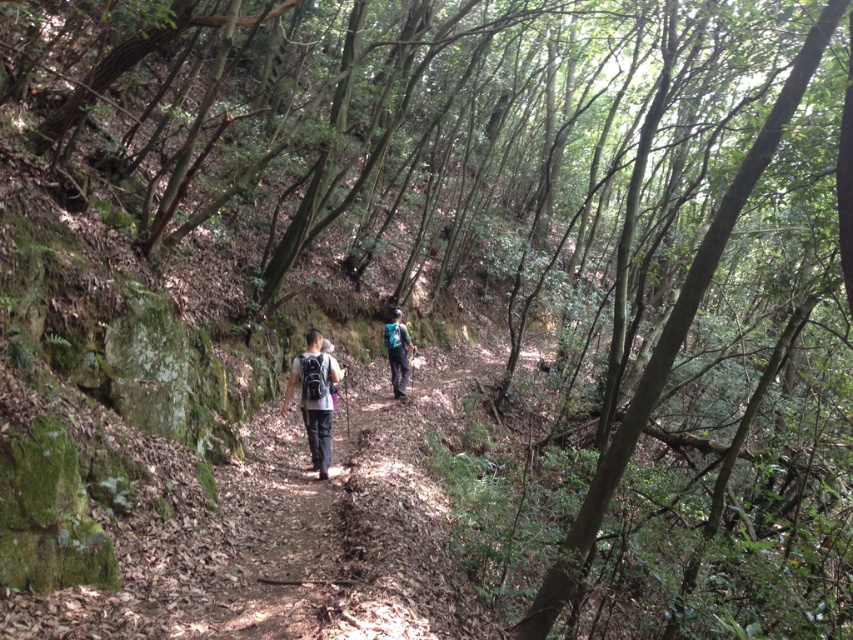
Can you confirm if matte black backpack at center is positioned to the left of blue fabric backpack at center?

Correct, you'll find matte black backpack at center to the left of blue fabric backpack at center.

Can you confirm if matte black backpack at center is taller than blue fabric backpack at center?

Indeed, matte black backpack at center has a greater height compared to blue fabric backpack at center.

Does point (317, 365) lie in front of point (384, 342)?

That is True.

The height and width of the screenshot is (640, 853). I want to click on matte black backpack at center, so click(314, 397).